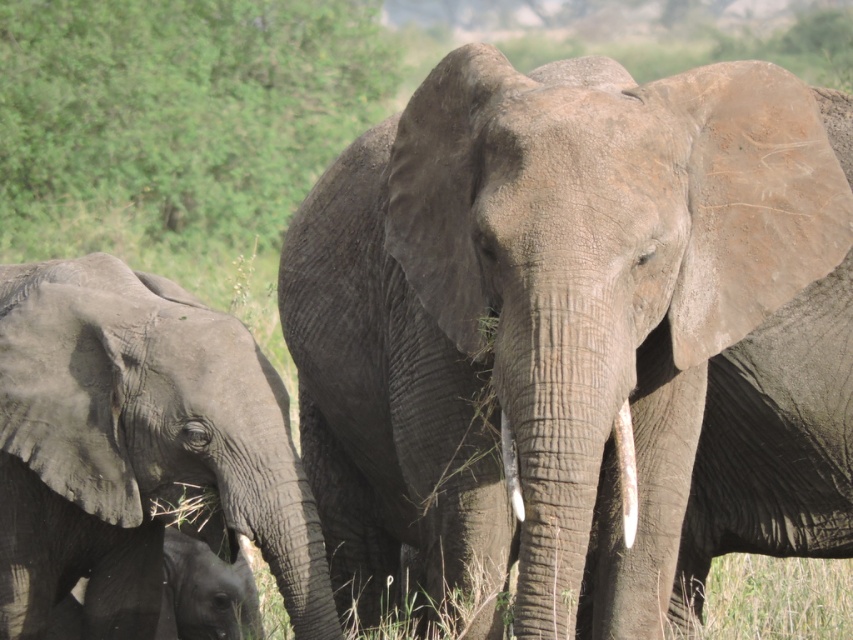
Question: Is white ivory tusk at center below white matte tusk at center?

Choices:
 (A) yes
 (B) no

Answer: (A)

Question: Which point is farther to the camera?

Choices:
 (A) (625, 428)
 (B) (509, 468)
 (C) (641, 218)

Answer: (A)

Question: Estimate the real-world distances between objects in this image. Which object is farther from the gray textured elephant at center?

Choices:
 (A) white ivory tusk at center
 (B) dark gray skin at lower left
 (C) white matte tusk at center

Answer: (B)

Question: Is the position of gray textured elephant at center less distant than that of white ivory tusk at center?

Choices:
 (A) yes
 (B) no

Answer: (A)

Question: Which of these objects is positioned farthest from the gray matte elephant at lower left?

Choices:
 (A) dark gray skin at lower left
 (B) white matte tusk at center

Answer: (B)

Question: Does gray textured elephant at center have a larger size compared to dark gray skin at lower left?

Choices:
 (A) yes
 (B) no

Answer: (A)